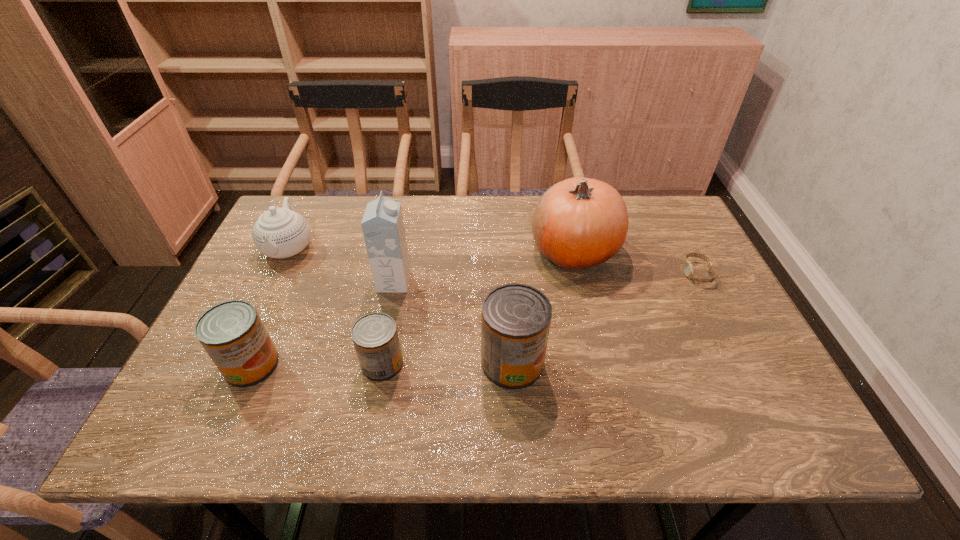
Find the location of a particular element. chinaware that is at the far edge is located at coordinates (279, 233).

Where is `can located in the left edge section of the desktop`? can located in the left edge section of the desktop is located at coordinates (232, 333).

Find the location of a particular element. The width and height of the screenshot is (960, 540). chinaware at the left edge is located at coordinates (279, 233).

In order to click on object at the right edge in this screenshot , I will do `click(688, 266)`.

What are the coordinates of `object that is at the far left corner` in the screenshot? It's located at (279, 233).

Locate an element on the screen. The width and height of the screenshot is (960, 540). object that is positioned at the near left corner is located at coordinates (232, 333).

The width and height of the screenshot is (960, 540). Find the location of `vacant space at the far edge of the desktop`. vacant space at the far edge of the desktop is located at coordinates (355, 197).

Locate an element on the screen. The height and width of the screenshot is (540, 960). vacant space at the near edge is located at coordinates 334,381.

The image size is (960, 540). What are the coordinates of `vacant space at the right edge of the desktop` in the screenshot? It's located at (749, 345).

In the image, there is a desktop. Where is `vacant space at the far right corner`? The height and width of the screenshot is (540, 960). vacant space at the far right corner is located at coordinates (632, 195).